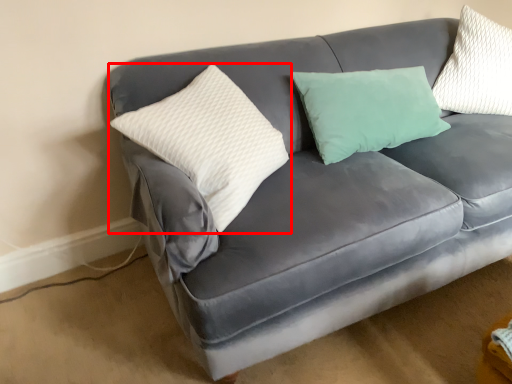
Question: From the image's perspective, where is pillow (annotated by the red box) located relative to pillow?

Choices:
 (A) below
 (B) above

Answer: (A)